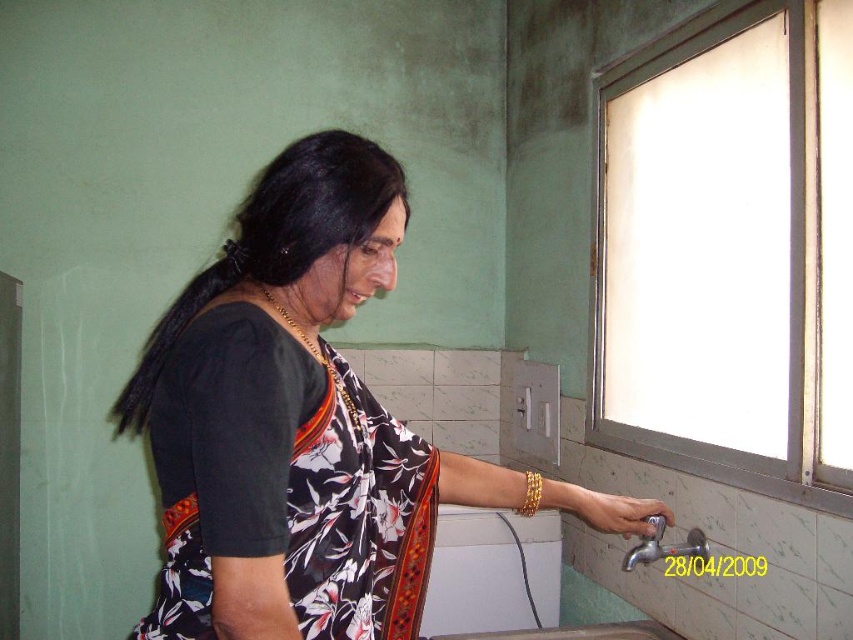
Can you confirm if black floral fabric sari at center is shorter than gold metallic bracelet at lower right?

No, black floral fabric sari at center is not shorter than gold metallic bracelet at lower right.

Can you confirm if black floral fabric sari at center is wider than gold metallic bracelet at lower right?

Yes.

This screenshot has width=853, height=640. Describe the element at coordinates (285, 483) in the screenshot. I see `black floral fabric sari at center` at that location.

Locate an element on the screen. This screenshot has width=853, height=640. black floral fabric sari at center is located at coordinates [285, 483].

Measure the distance between black floral saree at center and white glossy sink at lower right.

69.28 centimeters

Between black floral saree at center and white glossy sink at lower right, which one is positioned higher?

black floral saree at center is above.

Locate an element on the screen. The image size is (853, 640). black floral saree at center is located at coordinates (292, 422).

Image resolution: width=853 pixels, height=640 pixels. What are the coordinates of `black floral saree at center` in the screenshot? It's located at (292, 422).

Can you confirm if white glossy sink at lower right is shorter than metallic silver faucet at lower right?

In fact, white glossy sink at lower right may be taller than metallic silver faucet at lower right.

Which is in front, point (654, 556) or point (625, 518)?

Point (625, 518) is more forward.

This screenshot has width=853, height=640. I want to click on white glossy sink at lower right, so click(567, 627).